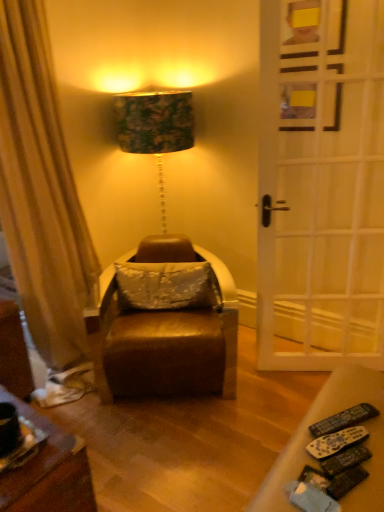
Question: Does leather swivel chair at center have a smaller size compared to white wooden door at right?

Choices:
 (A) yes
 (B) no

Answer: (B)

Question: From a real-world perspective, is leather swivel chair at center located beneath white wooden door at right?

Choices:
 (A) no
 (B) yes

Answer: (B)

Question: Would you say leather swivel chair at center is outside white wooden door at right?

Choices:
 (A) yes
 (B) no

Answer: (A)

Question: Is leather swivel chair at center at the right side of white wooden door at right?

Choices:
 (A) yes
 (B) no

Answer: (B)

Question: Is leather swivel chair at center thinner than white wooden door at right?

Choices:
 (A) no
 (B) yes

Answer: (A)

Question: Can white wooden door at right be found inside leather swivel chair at center?

Choices:
 (A) yes
 (B) no

Answer: (B)

Question: Does white wooden door at right appear on the left side of black plastic remote control at lower right, which is the 2th remote control from back to front?

Choices:
 (A) no
 (B) yes

Answer: (A)

Question: Is white wooden door at right wider than black plastic remote control at lower right, arranged as the first remote control when viewed from the front?

Choices:
 (A) no
 (B) yes

Answer: (A)

Question: Does white wooden door at right contain black plastic remote control at lower right, which is the 2th remote control from back to front?

Choices:
 (A) no
 (B) yes

Answer: (A)

Question: Does white wooden door at right touch black plastic remote control at lower right, which is the 2th remote control from back to front?

Choices:
 (A) no
 (B) yes

Answer: (A)

Question: Considering the relative positions of white wooden door at right and black plastic remote control at lower right, which is the 2th remote control from back to front, in the image provided, is white wooden door at right to the right of black plastic remote control at lower right, which is the 2th remote control from back to front, from the viewer's perspective?

Choices:
 (A) yes
 (B) no

Answer: (A)

Question: Can you confirm if white wooden door at right is shorter than black plastic remote control at lower right, arranged as the first remote control when viewed from the front?

Choices:
 (A) yes
 (B) no

Answer: (B)

Question: From the image's perspective, is white wooden door at right under satin white pillow at center?

Choices:
 (A) no
 (B) yes

Answer: (A)